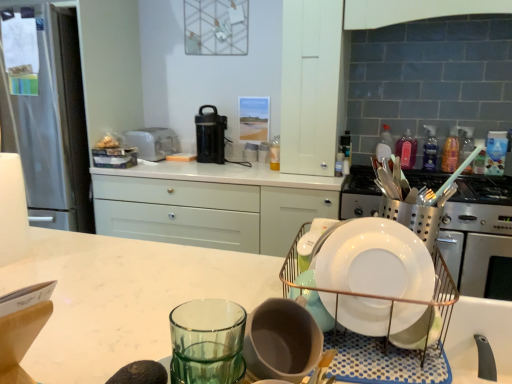
Question: Is satin silver toaster at upper center looking in the opposite direction of pink plastic bottle at upper right, the first bottle in the right-to-left sequence?

Choices:
 (A) yes
 (B) no

Answer: (B)

Question: Is satin silver toaster at upper center thinner than pink plastic bottle at upper right, the first bottle in the right-to-left sequence?

Choices:
 (A) no
 (B) yes

Answer: (A)

Question: Would you say satin silver toaster at upper center is a long distance from pink plastic bottle at upper right, the first bottle in the right-to-left sequence?

Choices:
 (A) no
 (B) yes

Answer: (B)

Question: From a real-world perspective, is satin silver toaster at upper center beneath pink plastic bottle at upper right, placed as the 5th bottle when sorted from left to right?

Choices:
 (A) yes
 (B) no

Answer: (A)

Question: Can we say satin silver toaster at upper center lies outside pink plastic bottle at upper right, the first bottle in the right-to-left sequence?

Choices:
 (A) no
 (B) yes

Answer: (B)

Question: Is white ceramic sink at lower right wider or thinner than clear plastic bottle at upper right, which appears as the 2th bottle when viewed from the right?

Choices:
 (A) thin
 (B) wide

Answer: (B)

Question: From a real-world perspective, is white ceramic sink at lower right above or below clear plastic bottle at upper right, which appears as the fourth bottle when viewed from the left?

Choices:
 (A) above
 (B) below

Answer: (B)

Question: Considering their positions, is white ceramic sink at lower right located in front of or behind clear plastic bottle at upper right, which appears as the 2th bottle when viewed from the right?

Choices:
 (A) behind
 (B) front

Answer: (B)

Question: In terms of height, does white ceramic sink at lower right look taller or shorter compared to clear plastic bottle at upper right, which appears as the 2th bottle when viewed from the right?

Choices:
 (A) tall
 (B) short

Answer: (B)

Question: Does point (435, 165) appear closer or farther from the camera than point (342, 190)?

Choices:
 (A) closer
 (B) farther

Answer: (B)

Question: Considering the relative positions of clear plastic bottle at upper right, which appears as the 2th bottle when viewed from the right, and satin silver gas stove at right in the image provided, is clear plastic bottle at upper right, which appears as the 2th bottle when viewed from the right, to the left or to the right of satin silver gas stove at right?

Choices:
 (A) left
 (B) right

Answer: (B)

Question: Considering the positions of clear plastic bottle at upper right, which appears as the 2th bottle when viewed from the right, and satin silver gas stove at right in the image, is clear plastic bottle at upper right, which appears as the 2th bottle when viewed from the right, taller or shorter than satin silver gas stove at right?

Choices:
 (A) tall
 (B) short

Answer: (A)

Question: Is clear plastic bottle at upper right, which appears as the fourth bottle when viewed from the left, spatially inside satin silver gas stove at right, or outside of it?

Choices:
 (A) inside
 (B) outside

Answer: (B)

Question: Considering their positions, is black plastic coffee maker at center located in front of or behind pink plastic bottle at upper right, acting as the third bottle starting from the left?

Choices:
 (A) behind
 (B) front

Answer: (A)

Question: Is point (217, 122) closer or farther from the camera than point (414, 157)?

Choices:
 (A) closer
 (B) farther

Answer: (B)